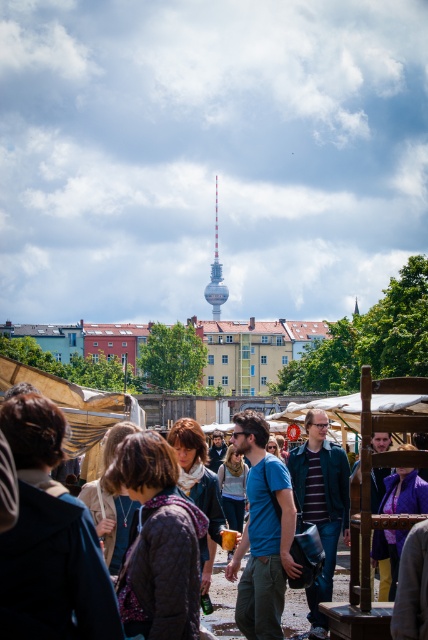
Question: Which object appears closest to the camera in this image?

Choices:
 (A) blue denim jacket at center
 (B) metallic silver tower at center

Answer: (A)

Question: Which point appears closest to the camera in this image?

Choices:
 (A) (222, 296)
 (B) (255, 445)

Answer: (B)

Question: Is blue denim jacket at center behind metallic silver tower at center?

Choices:
 (A) yes
 (B) no

Answer: (B)

Question: Which point is farther to the camera?

Choices:
 (A) (207, 294)
 (B) (419, 420)

Answer: (A)

Question: Is blue denim jacket at center to the left of metallic silver tower at center from the viewer's perspective?

Choices:
 (A) yes
 (B) no

Answer: (B)

Question: In this image, where is blue denim jacket at center located relative to metallic silver tower at center?

Choices:
 (A) right
 (B) left

Answer: (A)